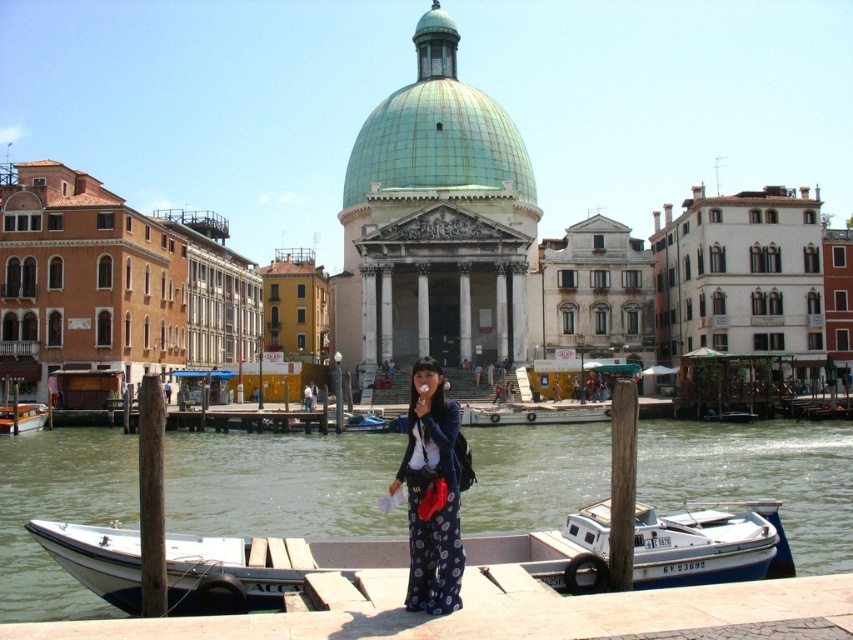
Between point (670, 525) and point (44, 413), which one is positioned in front?

Point (670, 525) is more forward.

Identify the location of white matte boat at lower center. Image resolution: width=853 pixels, height=640 pixels. (260, 568).

Does white matte boat at lower center appear on the right side of green copper dome at center?

Yes, white matte boat at lower center is to the right of green copper dome at center.

Is point (581, 561) in front of point (404, 131)?

Yes.

Where is `white matte boat at lower center`? white matte boat at lower center is located at coordinates (260, 568).

Does green copper dome at center appear on the right side of white glossy boat at center?

Indeed, green copper dome at center is positioned on the right side of white glossy boat at center.

Consider the image. Between green copper dome at center and white glossy boat at center, which one appears on the right side from the viewer's perspective?

Positioned to the right is green copper dome at center.

This screenshot has width=853, height=640. I want to click on green copper dome at center, so click(x=437, y=131).